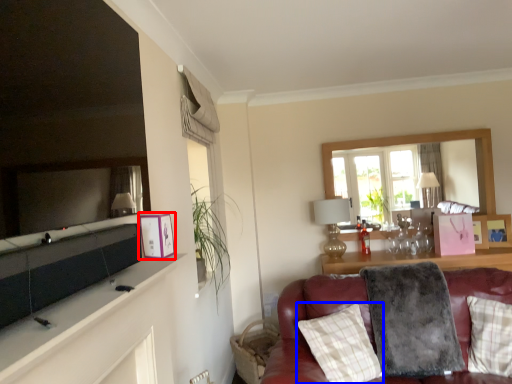
Question: Which of the following is the farthest to the observer, picture frame (highlighted by a red box) or pillow (highlighted by a blue box)?

Choices:
 (A) picture frame
 (B) pillow

Answer: (B)